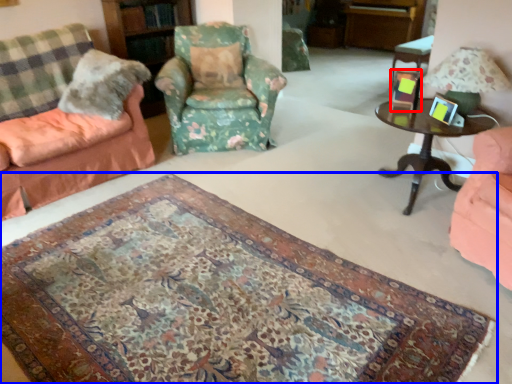
Question: Which point is closer to the camera, picture frame (highlighted by a red box) or mat (highlighted by a blue box)?

Choices:
 (A) picture frame
 (B) mat

Answer: (B)